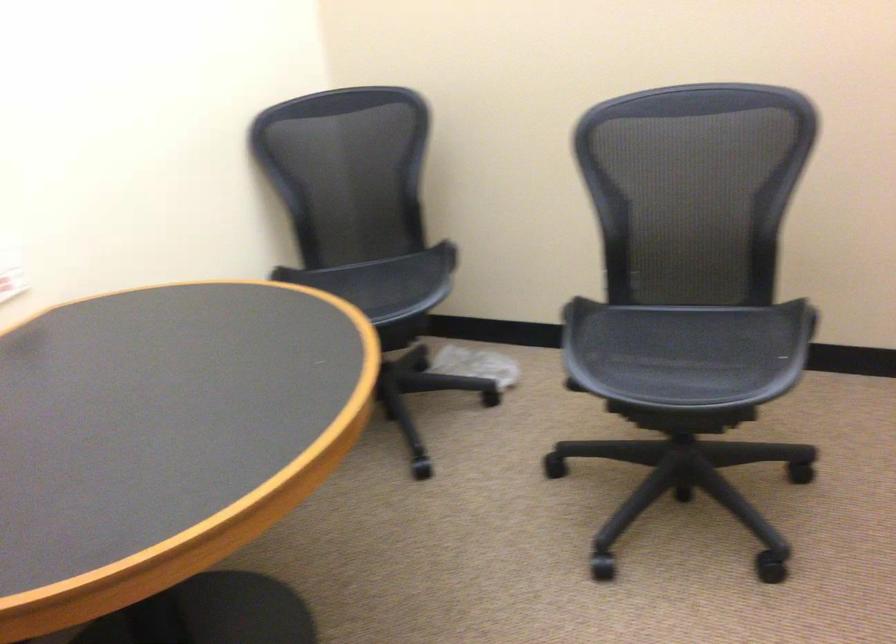
You are a GUI agent. You are given a task and a screenshot of the screen. Output one action in this format:
    pyautogui.click(x=<x>, y=<y>)
    Task: Click on the plastic wrap
    
    Given the screenshot: What is the action you would take?
    pyautogui.click(x=476, y=365)